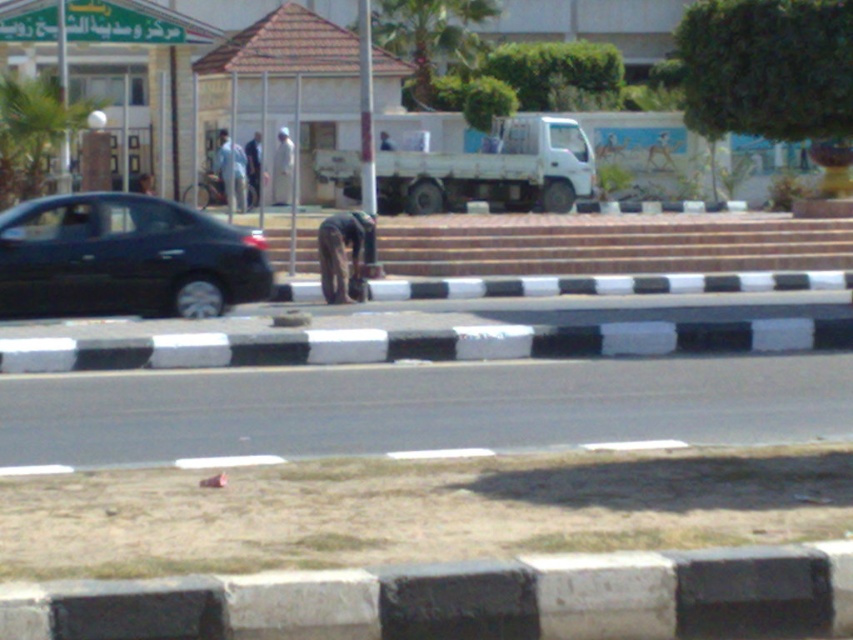
What do you see at coordinates (431, 38) in the screenshot?
I see `green leafy palm tree at upper center` at bounding box center [431, 38].

Is green leafy palm tree at upper center below light brown fabric pants at center?

Incorrect, green leafy palm tree at upper center is not positioned below light brown fabric pants at center.

Is point (397, 49) farther from viewer compared to point (259, 132)?

Yes.

This screenshot has width=853, height=640. What are the coordinates of `green leafy palm tree at upper center` in the screenshot? It's located at (431, 38).

Can you confirm if shiny black sedan at left is smaller than dark brown leather jacket at center?

Actually, shiny black sedan at left might be larger than dark brown leather jacket at center.

Does shiny black sedan at left have a greater width compared to dark brown leather jacket at center?

Yes, shiny black sedan at left is wider than dark brown leather jacket at center.

Describe the element at coordinates (125, 259) in the screenshot. I see `shiny black sedan at left` at that location.

What are the coordinates of `shiny black sedan at left` in the screenshot? It's located at (125, 259).

Is point (38, 289) less distant than point (76, 369)?

No.

Is shiny black sedan at left to the right of black rubber barrier at center from the viewer's perspective?

No, shiny black sedan at left is not to the right of black rubber barrier at center.

Find the location of a particular element. shiny black sedan at left is located at coordinates (125, 259).

This screenshot has height=640, width=853. What are the coordinates of `shiny black sedan at left` in the screenshot? It's located at (125, 259).